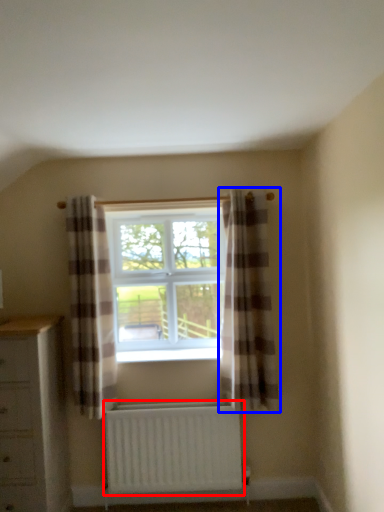
Question: Which of the following is the closest to the observer, radiator (highlighted by a red box) or curtain (highlighted by a blue box)?

Choices:
 (A) radiator
 (B) curtain

Answer: (B)